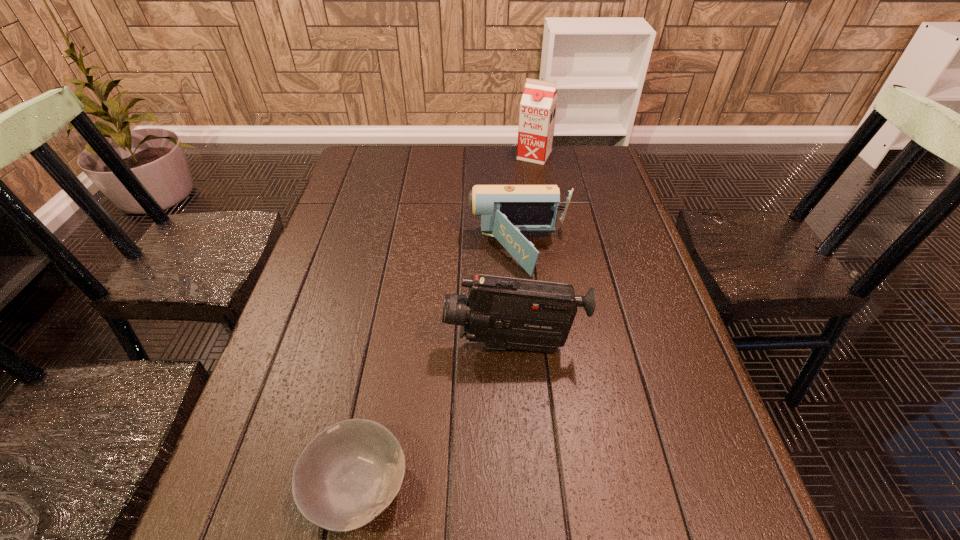
Find the location of `the tallest object`. the tallest object is located at coordinates (538, 106).

Locate an element on the screen. The image size is (960, 540). soya milk is located at coordinates (538, 106).

Locate an element on the screen. This screenshot has height=540, width=960. the second nearest object is located at coordinates (502, 312).

Where is `the nearer camcorder`? The height and width of the screenshot is (540, 960). the nearer camcorder is located at coordinates (502, 312).

The image size is (960, 540). I want to click on the farther camcorder, so click(x=506, y=211).

Find the location of `the second farthest object`. the second farthest object is located at coordinates (506, 211).

You are a GUI agent. You are given a task and a screenshot of the screen. Output one action in this format:
    pyautogui.click(x=<x>, y=<y>)
    Task: Click on the free spot located on the right of the tallest object
    Image resolution: width=960 pixels, height=540 pixels.
    Given the screenshot: What is the action you would take?
    pyautogui.click(x=598, y=156)

The height and width of the screenshot is (540, 960). I want to click on free space located on the front-facing side of the nearer camcorder, so click(385, 345).

Locate an element on the screen. vacant space located on the front-facing side of the nearer camcorder is located at coordinates (418, 345).

Identify the location of vacant position located 0.070m on the front-facing side of the nearer camcorder. (413, 345).